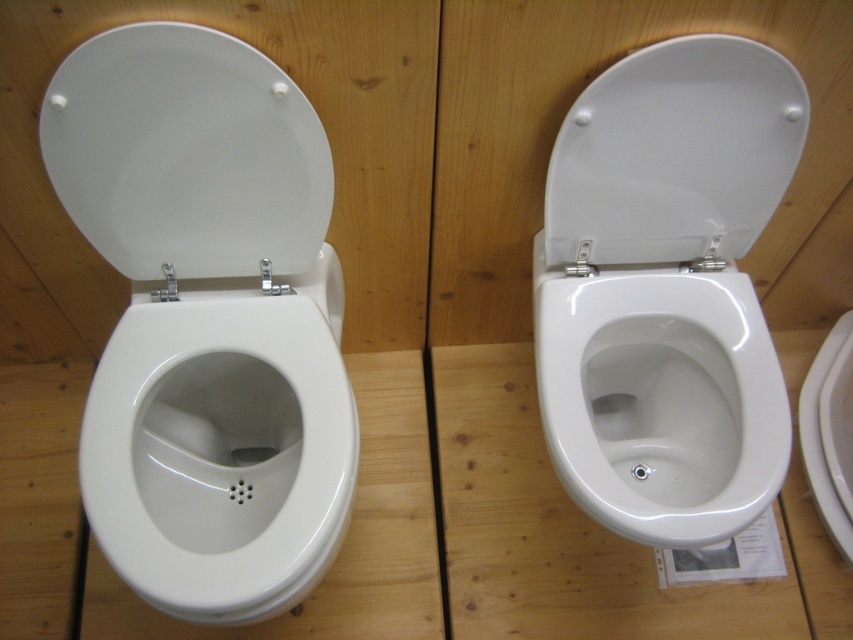
Is white glossy toilet at upper center thinner than white glossy toilet seat at upper right?

In fact, white glossy toilet at upper center might be wider than white glossy toilet seat at upper right.

Between white glossy toilet at upper center and white glossy toilet seat at upper right, which one appears on the left side from the viewer's perspective?

white glossy toilet at upper center

You are a GUI agent. You are given a task and a screenshot of the screen. Output one action in this format:
    pyautogui.click(x=<x>, y=<y>)
    Task: Click on the white glossy toilet at upper center
    
    Given the screenshot: What is the action you would take?
    pyautogui.click(x=666, y=289)

Does white glossy toilet bowl at left have a lesser height compared to white glossy toilet seat at upper right?

In fact, white glossy toilet bowl at left may be taller than white glossy toilet seat at upper right.

Which of these two, white glossy toilet bowl at left or white glossy toilet seat at upper right, stands shorter?

white glossy toilet seat at upper right is shorter.

Between point (148, 467) and point (747, 70), which one is positioned behind?

Point (148, 467)

Locate an element on the screen. white glossy toilet bowl at left is located at coordinates (219, 454).

Who is lower down, glossy ceramic toilet at upper left or white glossy toilet seat at upper right?

glossy ceramic toilet at upper left

Is point (167, 64) behind point (663, 125)?

No, (167, 64) is closer to viewer.

Locate an element on the screen. glossy ceramic toilet at upper left is located at coordinates (207, 320).